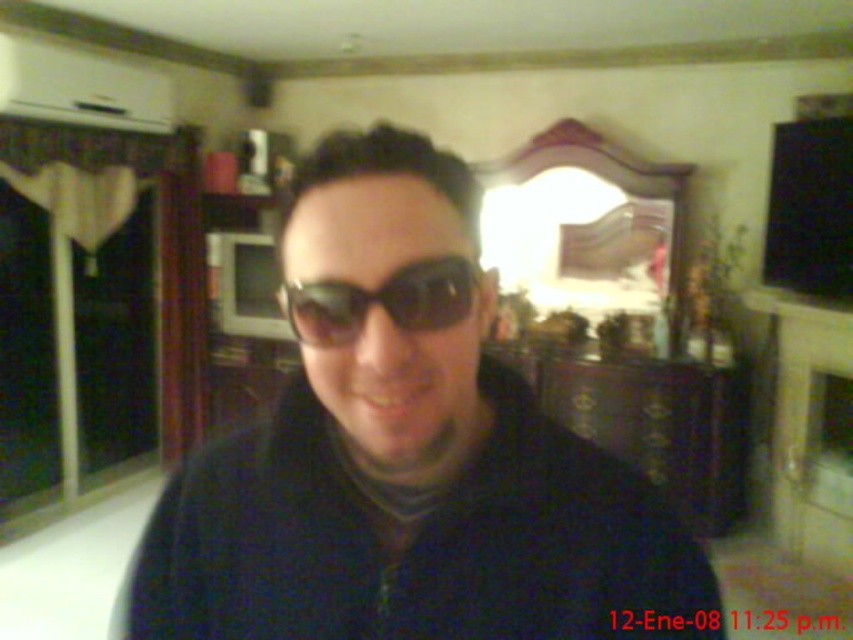
Question: Is black matte sunglasses at center above black reflective sunglasses at center?

Choices:
 (A) yes
 (B) no

Answer: (B)

Question: Which of the following is the farthest from the observer?

Choices:
 (A) black reflective sunglasses at center
 (B) black matte sunglasses at center

Answer: (A)

Question: Which object is farther from the camera taking this photo?

Choices:
 (A) black matte sunglasses at center
 (B) black reflective sunglasses at center

Answer: (B)

Question: Does black matte sunglasses at center have a lesser width compared to black reflective sunglasses at center?

Choices:
 (A) yes
 (B) no

Answer: (B)

Question: Is black matte sunglasses at center closer to camera compared to black reflective sunglasses at center?

Choices:
 (A) no
 (B) yes

Answer: (B)

Question: Which point appears closest to the camera in this image?

Choices:
 (A) (508, 563)
 (B) (350, 300)

Answer: (B)